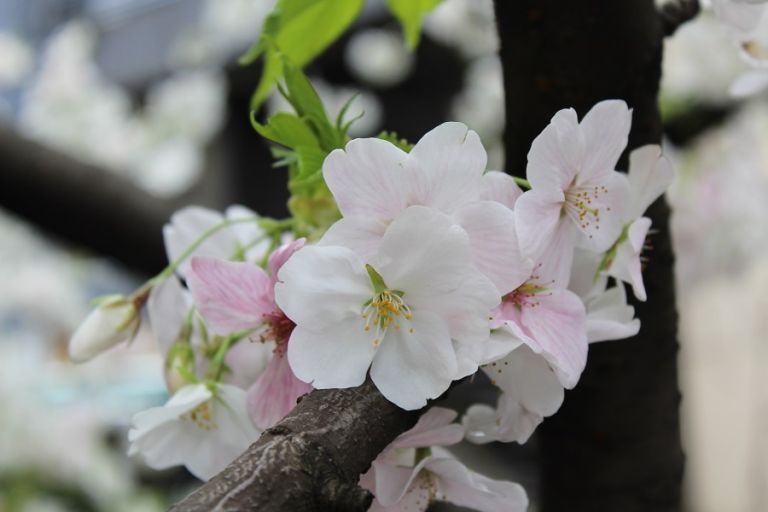
Locate an element on the screen. The image size is (768, 512). background flowers is located at coordinates click(x=181, y=229), click(x=167, y=311), click(x=465, y=480), click(x=502, y=443), click(x=517, y=400).